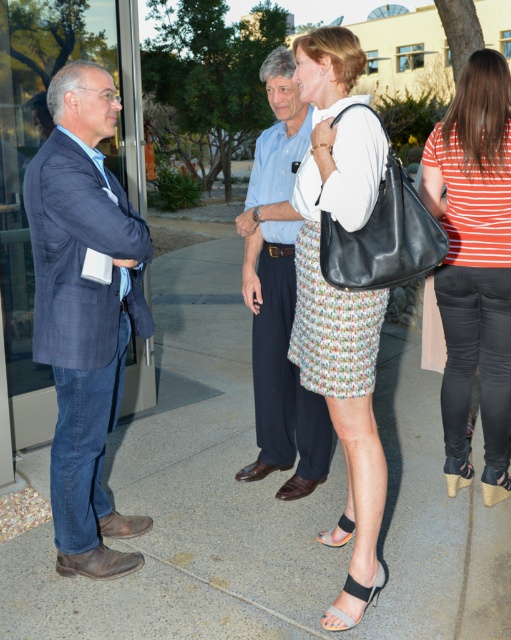
Question: Does striped cotton shirt at right have a smaller size compared to leather high-heeled sandal at center?

Choices:
 (A) no
 (B) yes

Answer: (A)

Question: Among these points, which one is farthest from the camera?

Choices:
 (A) (35, 220)
 (B) (378, 564)
 (C) (260, 308)
 (D) (474, 285)

Answer: (C)

Question: Does blue denim jeans at left have a larger size compared to brown leather shoes at center?

Choices:
 (A) yes
 (B) no

Answer: (B)

Question: Among these points, which one is farthest from the camera?

Choices:
 (A) (352, 588)
 (B) (350, 524)

Answer: (B)

Question: Which of the following is the farthest from the observer?

Choices:
 (A) striped cotton shirt at right
 (B) blue denim jeans at left
 (C) gray suede sandal at lower center
 (D) white textured blouse at center

Answer: (A)

Question: Does white textured blouse at center come behind leather wedge sandal at lower right?

Choices:
 (A) yes
 (B) no

Answer: (B)